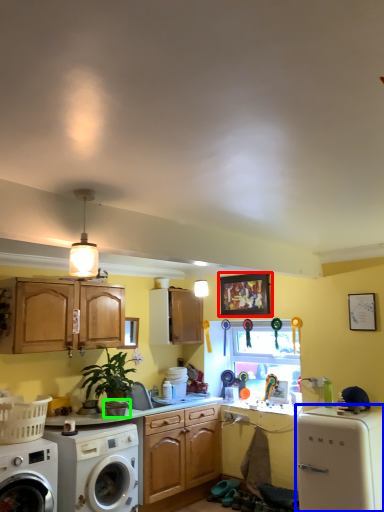
Question: Which is nearer to the picture frame (highlighted by a red box)? dish washer (highlighted by a blue box) or appliance (highlighted by a green box).

Choices:
 (A) dish washer
 (B) appliance

Answer: (A)